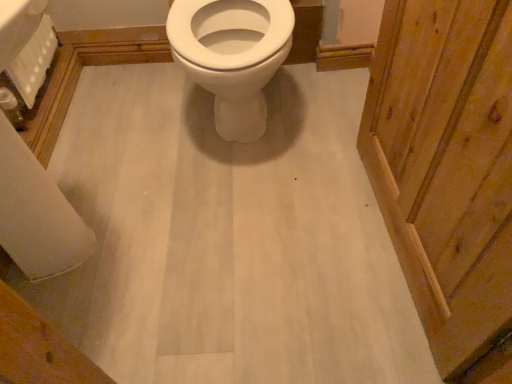
Where is `vacant location below white textured toilet paper at upper left, which appears as the 2th toilet paper when viewed from the right (from a real-world perspective)`? vacant location below white textured toilet paper at upper left, which appears as the 2th toilet paper when viewed from the right (from a real-world perspective) is located at coordinates (47, 81).